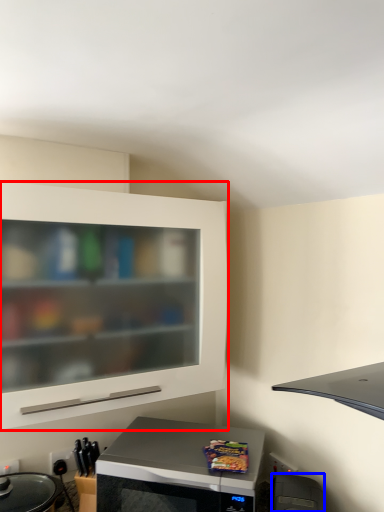
Question: Which object is closer to the camera taking this photo, cabinetry (highlighted by a red box) or appliance (highlighted by a blue box)?

Choices:
 (A) cabinetry
 (B) appliance

Answer: (B)